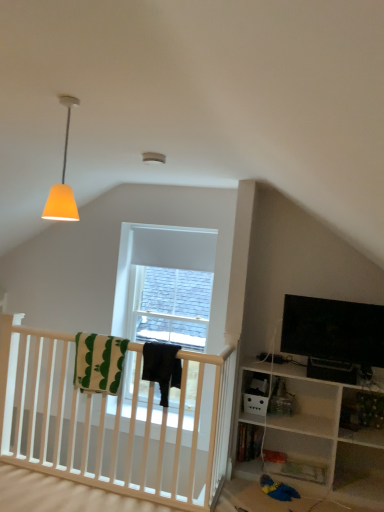
Question: From the image's perspective, relative to black fabric at center, the second blanket when ordered from left to right, is wooden bookshelf at lower right above or below?

Choices:
 (A) above
 (B) below

Answer: (B)

Question: Is wooden bookshelf at lower right to the left or to the right of black fabric at center, the second blanket when ordered from left to right, in the image?

Choices:
 (A) left
 (B) right

Answer: (B)

Question: Based on their relative distances, which object is nearer to the black glossy tv at right?

Choices:
 (A) white cotton blanket at center, the second blanket in the right-to-left sequence
 (B) orange matte lampshade at upper left
 (C) wooden bookshelf at lower right
 (D) black fabric at center, the second blanket when ordered from left to right

Answer: (C)

Question: Which object is positioned closest to the white cotton blanket at center, positioned as the first blanket in left-to-right order?

Choices:
 (A) orange matte lampshade at upper left
 (B) wooden bookshelf at lower right
 (C) black glossy tv at right
 (D) black fabric at center, placed as the 1th blanket when sorted from right to left

Answer: (D)